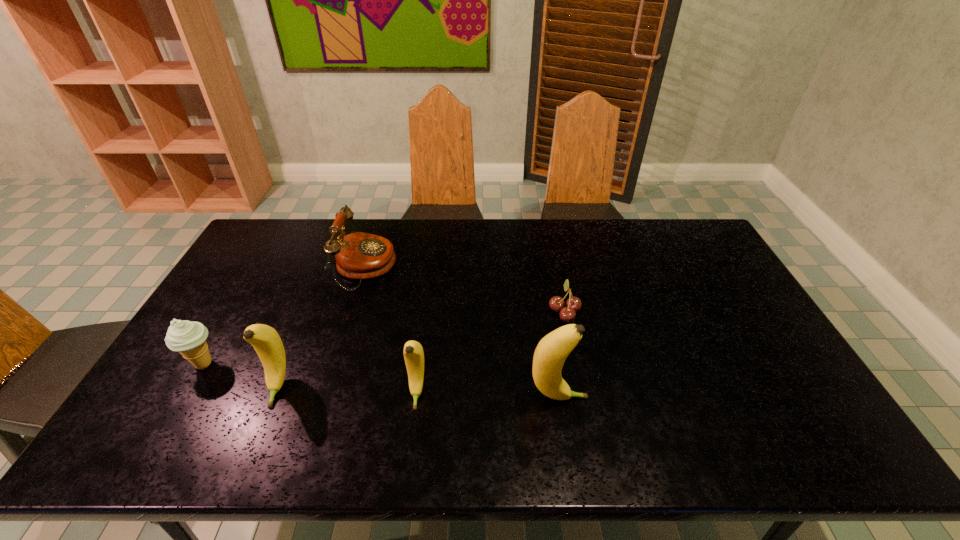
The image size is (960, 540). Find the location of `free space between the farthest object and the leftmost object`. free space between the farthest object and the leftmost object is located at coordinates (284, 315).

Identify which object is the second closest to the second banana from right to left. Please provide its 2D coordinates. Your answer should be formatted as a tuple, i.e. [(x, y)], where the tuple contains the x and y coordinates of a point satisfying the conditions above.

[(267, 343)]

Select which object is the second closest to the leftmost banana. Please provide its 2D coordinates. Your answer should be formatted as a tuple, i.e. [(x, y)], where the tuple contains the x and y coordinates of a point satisfying the conditions above.

[(359, 255)]

The width and height of the screenshot is (960, 540). Identify the location of banana identified as the third closest to the cherry. (267, 343).

I want to click on the closest banana to the fourth object from right to left, so click(x=267, y=343).

Where is `free space that satisfies the following two spatial constraints: 1. on the leaves of the cherry; 2. from the stem of the second tallest object`? free space that satisfies the following two spatial constraints: 1. on the leaves of the cherry; 2. from the stem of the second tallest object is located at coordinates pyautogui.click(x=580, y=387).

Find the location of a particular element. blank area in the image that satisfies the following two spatial constraints: 1. on the leaves of the shortest object; 2. from the stem of the second banana from left to right is located at coordinates (581, 393).

Image resolution: width=960 pixels, height=540 pixels. In order to click on free point that satisfies the following two spatial constraints: 1. on the dial of the telephone; 2. from the stem of the fifth shortest object in this screenshot , I will do `click(328, 387)`.